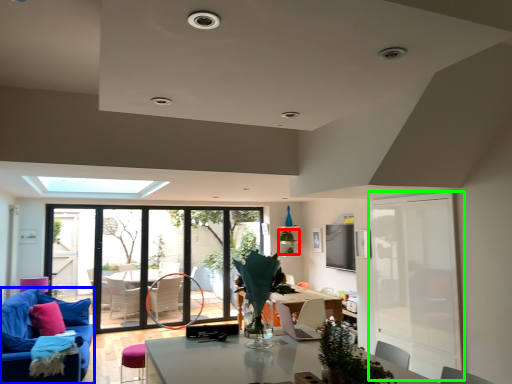
Question: Which object is positioned closest to plant (highlighted by a red box)? Select from studio couch (highlighted by a blue box) and screen door (highlighted by a green box).

Choices:
 (A) studio couch
 (B) screen door

Answer: (B)